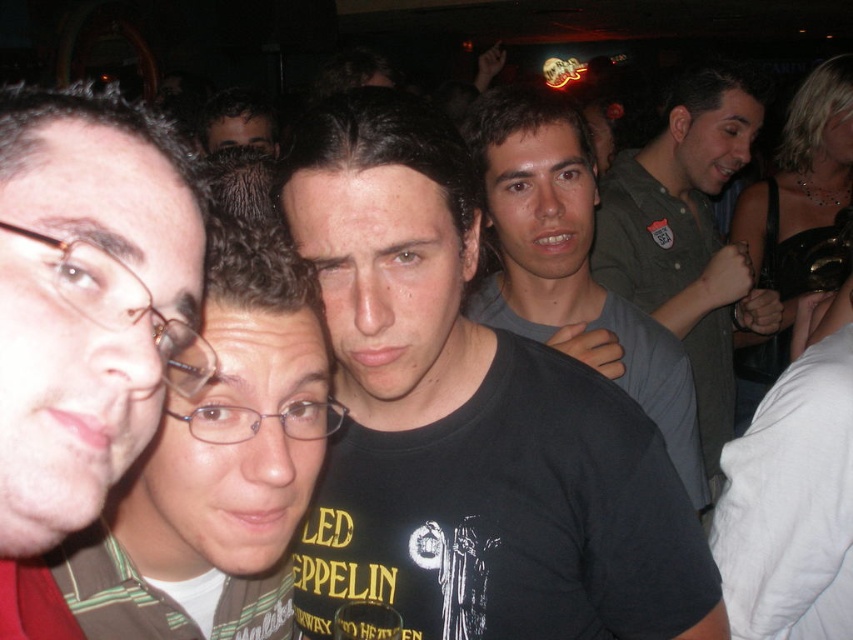
Question: Which object is closer to the camera taking this photo?

Choices:
 (A) matte brown hair at left
 (B) green shirt at center

Answer: (A)

Question: Which point is closer to the camera taking this photo?

Choices:
 (A) (53, 538)
 (B) (634, 360)
 (C) (683, 99)

Answer: (A)

Question: Is black matte t-shirt at center further to camera compared to matte brown hair at left?

Choices:
 (A) yes
 (B) no

Answer: (A)

Question: Is black matte t-shirt at center smaller than black matte shirt at center?

Choices:
 (A) yes
 (B) no

Answer: (A)

Question: Does matte brown hair at left lie in front of green shirt at center?

Choices:
 (A) yes
 (B) no

Answer: (A)

Question: Based on their relative distances, which object is farther from the black matte shirt at center?

Choices:
 (A) black matte t-shirt at center
 (B) green shirt at center
 (C) matte brown hair at left

Answer: (C)